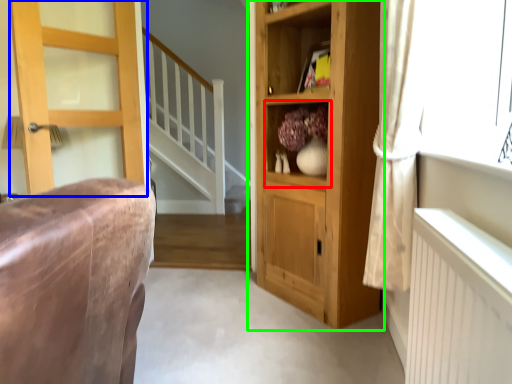
Question: Estimate the real-world distances between objects in this image. Which object is farther from cabinet (highlighted by a red box), door (highlighted by a blue box) or cupboard (highlighted by a green box)?

Choices:
 (A) door
 (B) cupboard

Answer: (A)